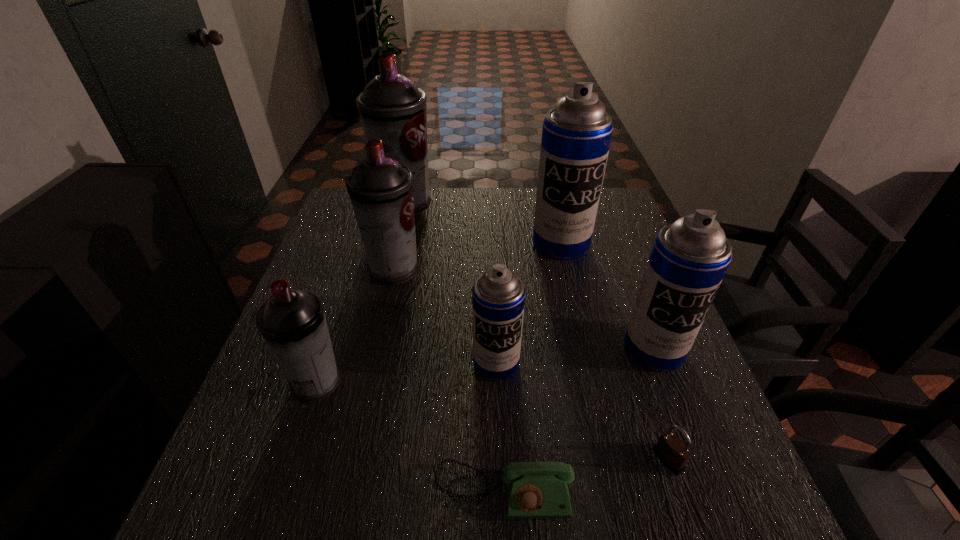
This screenshot has width=960, height=540. Identify the location of padlock located in the right edge section of the desktop. (671, 451).

Locate an element on the screen. The image size is (960, 540). object that is at the far left corner is located at coordinates (392, 109).

Where is `object present at the far right corner`? The image size is (960, 540). object present at the far right corner is located at coordinates (576, 135).

This screenshot has width=960, height=540. In order to click on vacant space at the far edge of the desktop in this screenshot , I will do `click(455, 217)`.

Locate an element on the screen. Image resolution: width=960 pixels, height=540 pixels. free space at the near edge of the desktop is located at coordinates (316, 487).

You are a GUI agent. You are given a task and a screenshot of the screen. Output one action in this format:
    pyautogui.click(x=<x>, y=<y>)
    Task: Click on the vacant space at the left edge of the desktop
    Image resolution: width=960 pixels, height=540 pixels.
    Given the screenshot: What is the action you would take?
    pyautogui.click(x=334, y=288)

The image size is (960, 540). Find the location of `free location at the right edge`. free location at the right edge is located at coordinates (660, 475).

This screenshot has height=540, width=960. In the image, there is a desktop. Identify the location of vacant space at the near left corner. (215, 523).

Locate an element on the screen. The image size is (960, 540). free point at the near right corner is located at coordinates (668, 500).

Where is `vacant area between the second smallest gray aerosol can and the second blue aerosol can from right to left`? vacant area between the second smallest gray aerosol can and the second blue aerosol can from right to left is located at coordinates (477, 256).